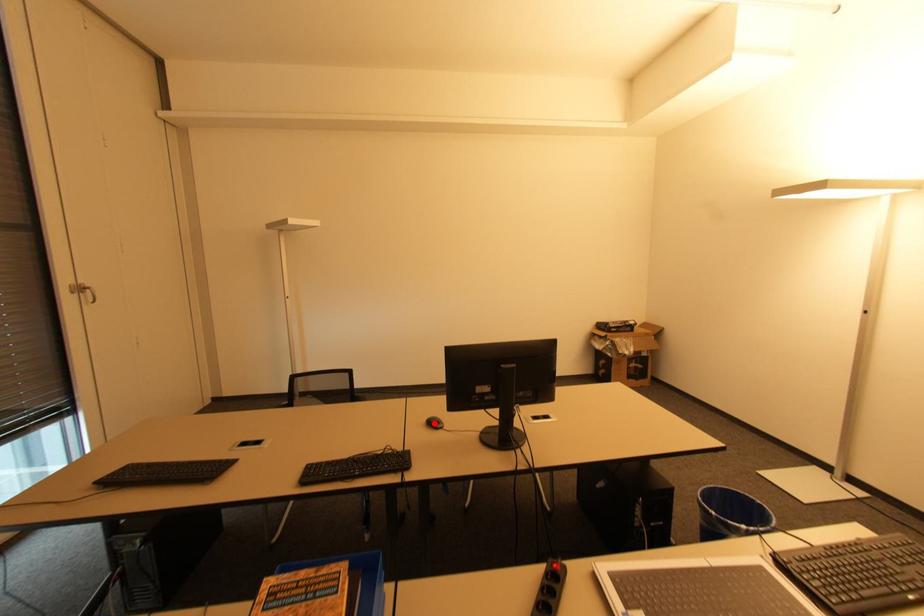
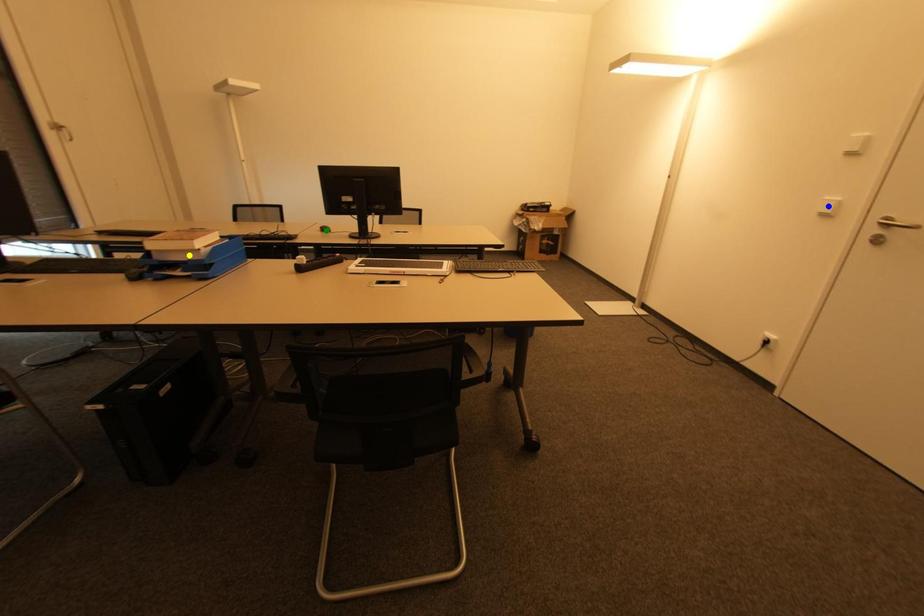
Question: I am providing you with two images of the same scene from different viewpoints. A red point is marked on the first image. You are given multiple points on the second image. Which spot in image 2 lines up with the point in image 1?

Choices:
 (A) yellow point
 (B) green point
 (C) blue point

Answer: (B)